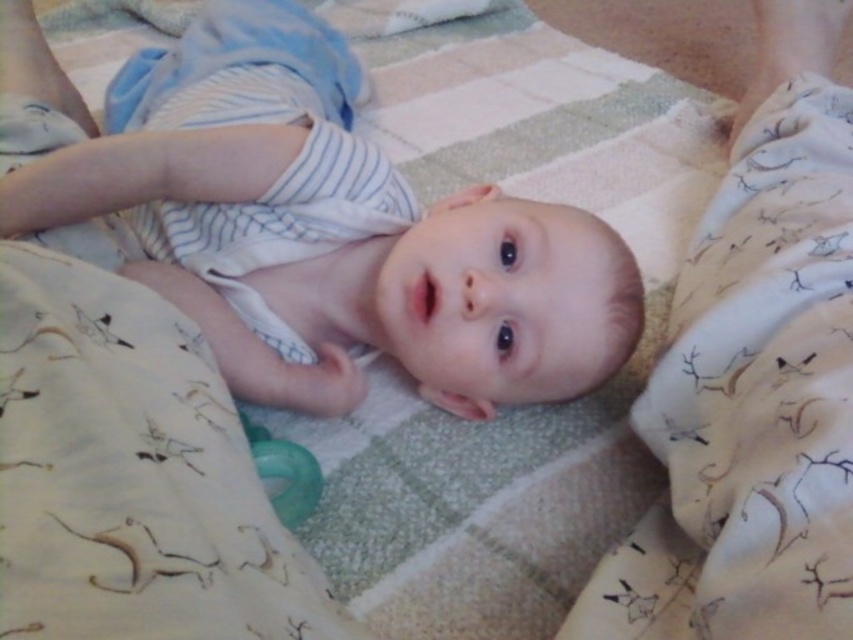
Between white soft baby at center and green rubber pacifier at center, which one has more height?

white soft baby at center is taller.

Between white soft baby at center and green rubber pacifier at center, which one is positioned lower?

green rubber pacifier at center is lower down.

What do you see at coordinates (434, 308) in the screenshot? I see `white soft baby at center` at bounding box center [434, 308].

Where is `white soft baby at center`? This screenshot has height=640, width=853. white soft baby at center is located at coordinates (434, 308).

In the scene shown: Does beige cotton blanket at lower right have a smaller size compared to light beige cotton blanket at center?

Incorrect, beige cotton blanket at lower right is not smaller in size than light beige cotton blanket at center.

Which is in front, point (695, 316) or point (202, 589)?

Positioned in front is point (202, 589).

Where is `beige cotton blanket at lower right`? This screenshot has height=640, width=853. beige cotton blanket at lower right is located at coordinates (751, 403).

Which is above, beige cotton blanket at lower right or green rubber pacifier at center?

beige cotton blanket at lower right is higher up.

Is point (762, 308) positioned before point (318, 496)?

Yes.

Is point (712, 419) in front of point (257, 467)?

Yes, point (712, 419) is in front of point (257, 467).

Image resolution: width=853 pixels, height=640 pixels. Find the location of `beige cotton blanket at lower right`. beige cotton blanket at lower right is located at coordinates (751, 403).